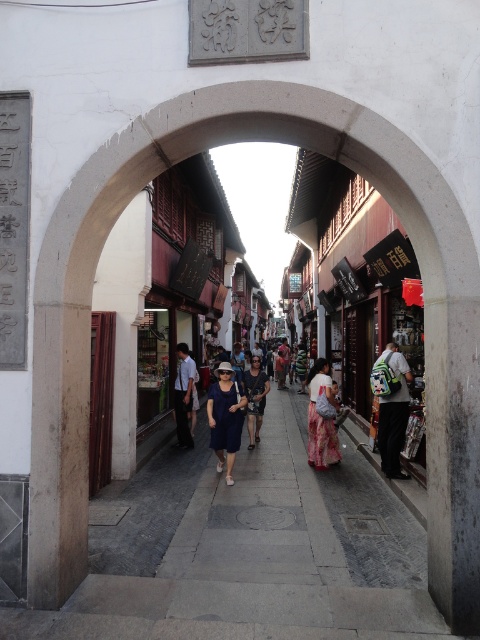
Question: Among these objects, which one is farthest from the camera?

Choices:
 (A) blue denim dress at center
 (B) blue cotton dress at center
 (C) gray stone pavement at center
 (D) floral silk dress at center

Answer: (A)

Question: In this image, where is blue cotton dress at center located relative to floral silk dress at center?

Choices:
 (A) left
 (B) right

Answer: (A)

Question: Considering the relative positions of blue cotton dress at center and floral silk dress at center in the image provided, where is blue cotton dress at center located with respect to floral silk dress at center?

Choices:
 (A) left
 (B) right

Answer: (A)

Question: Which point is farther to the camera?

Choices:
 (A) blue denim dress at center
 (B) blue cotton dress at center

Answer: (A)

Question: Is blue cotton dress at center bigger than blue denim dress at center?

Choices:
 (A) yes
 (B) no

Answer: (B)

Question: Which point is closer to the camera?

Choices:
 (A) (214, 440)
 (B) (328, 429)
 (C) (178, 616)
 (D) (256, 371)

Answer: (C)